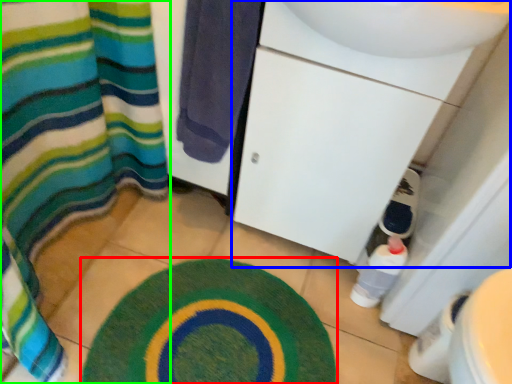
Question: Which is nearer to the bath mat (highlighted by a red box)? sink (highlighted by a blue box) or curtain (highlighted by a green box).

Choices:
 (A) sink
 (B) curtain

Answer: (B)